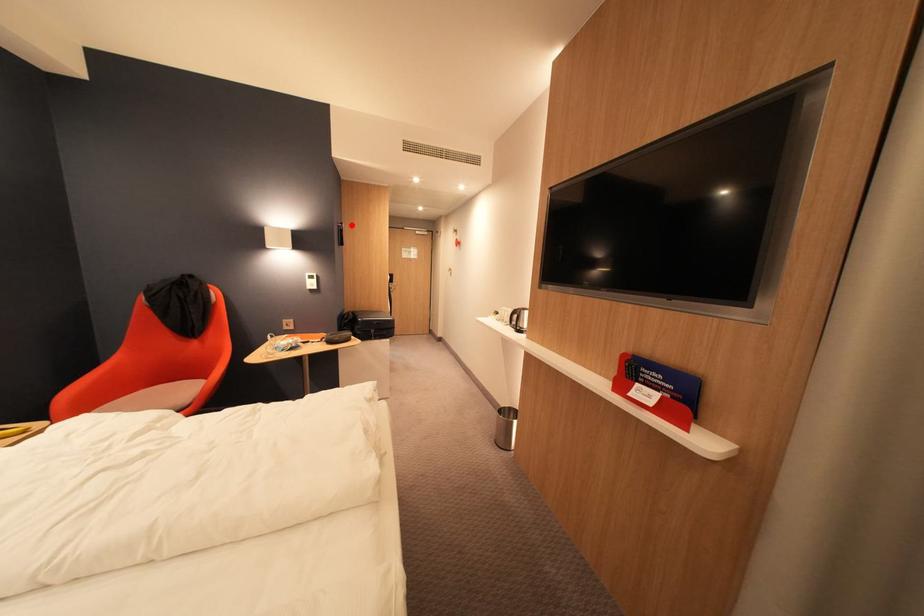
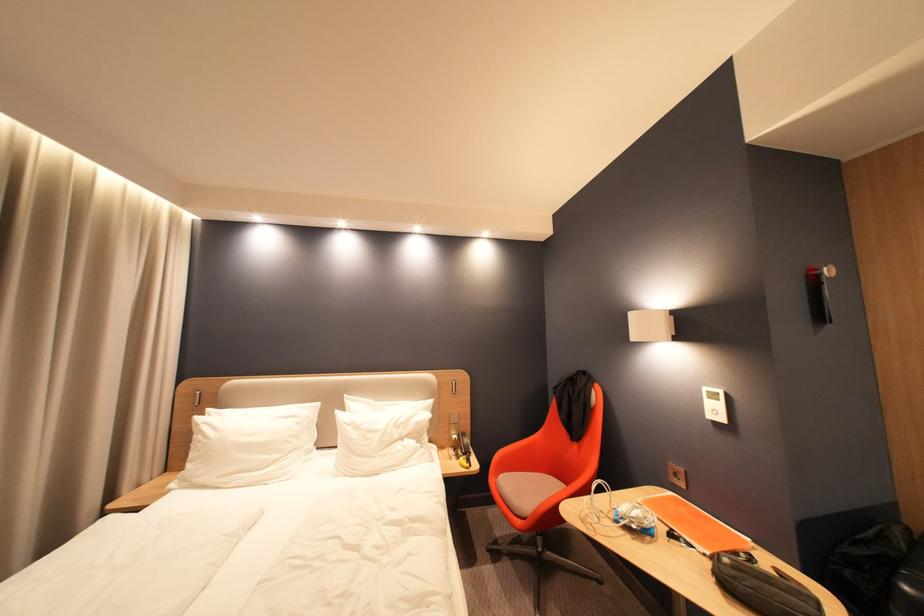
In the second image, find the point that corresponds to the highlighted location in the first image.

(830, 270)